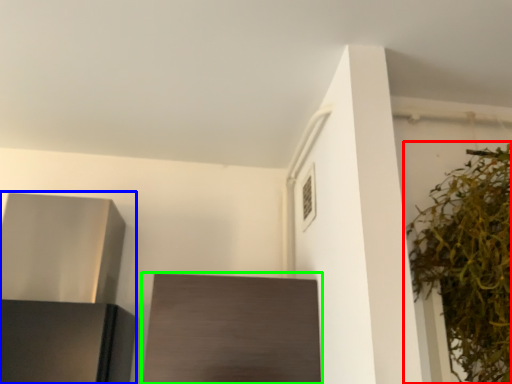
Question: Which object is positioned closest to houseplant (highlighted by a red box)? Select from appliance (highlighted by a blue box) and cabinetry (highlighted by a green box).

Choices:
 (A) appliance
 (B) cabinetry

Answer: (B)